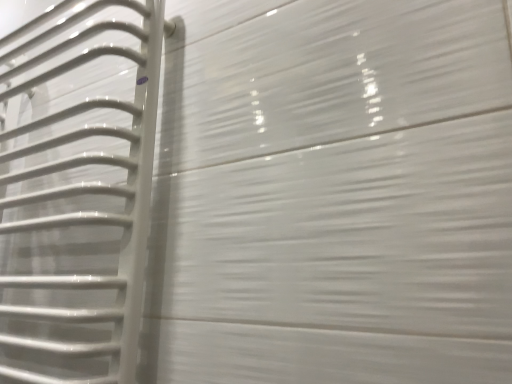
Question: Should I look upward or downward to see white glossy towel rack at left?

Choices:
 (A) down
 (B) up

Answer: (B)